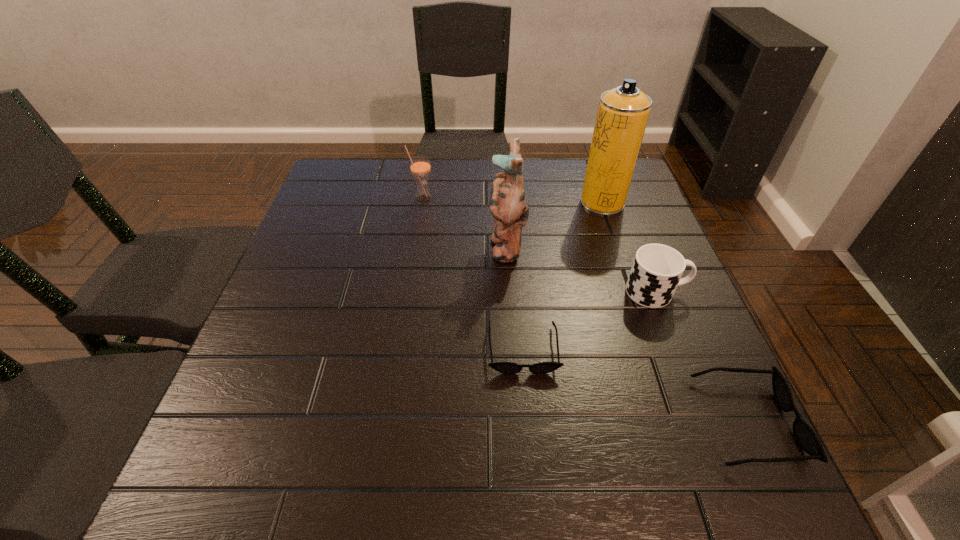
Identify the location of sunglasses present at the right edge. The width and height of the screenshot is (960, 540). (806, 437).

Identify the location of aerosol can located in the right edge section of the desktop. The width and height of the screenshot is (960, 540). (622, 115).

Identify the location of cup that is at the right edge. (657, 269).

At what (x,y) coordinates should I click in order to perform the action: click on object at the far right corner. Please return your answer as a coordinate pair (x, y). This screenshot has height=540, width=960. Looking at the image, I should click on (622, 115).

The height and width of the screenshot is (540, 960). In order to click on object at the near right corner in this screenshot , I will do `click(806, 437)`.

This screenshot has width=960, height=540. I want to click on blank space at the far edge of the desktop, so click(481, 176).

Locate an element on the screen. The image size is (960, 540). free space at the near edge of the desktop is located at coordinates (598, 403).

The width and height of the screenshot is (960, 540). In the image, there is a desktop. What are the coordinates of `vacant space at the left edge` in the screenshot? It's located at (359, 211).

You are a GUI agent. You are given a task and a screenshot of the screen. Output one action in this format:
    pyautogui.click(x=<x>, y=<y>)
    Task: Click on the free space at the right edge
    The image size is (960, 540).
    Given the screenshot: What is the action you would take?
    pyautogui.click(x=667, y=305)

Find the location of `empty space between the nearest object and the fourth farthest object`. empty space between the nearest object and the fourth farthest object is located at coordinates (701, 356).